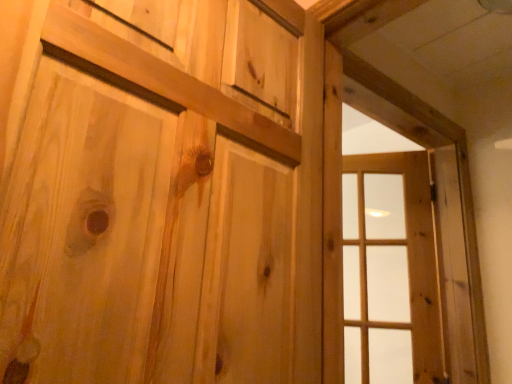
Question: Does natural wood window frame at right have a greater height compared to natural wood door at center?

Choices:
 (A) no
 (B) yes

Answer: (B)

Question: Can you confirm if natural wood window frame at right is shorter than natural wood door at center?

Choices:
 (A) no
 (B) yes

Answer: (A)

Question: Is natural wood window frame at right oriented towards natural wood door at center?

Choices:
 (A) no
 (B) yes

Answer: (A)

Question: Considering the relative positions of natural wood window frame at right and natural wood door at center in the image provided, is natural wood window frame at right to the left of natural wood door at center from the viewer's perspective?

Choices:
 (A) yes
 (B) no

Answer: (B)

Question: Is natural wood window frame at right positioned beyond the bounds of natural wood door at center?

Choices:
 (A) no
 (B) yes

Answer: (B)

Question: Is natural wood window frame at right positioned with its back to natural wood door at center?

Choices:
 (A) yes
 (B) no

Answer: (B)

Question: Can you confirm if clear glass window at right is taller than natural wood window frame at right?

Choices:
 (A) no
 (B) yes

Answer: (A)

Question: Considering the relative sizes of clear glass window at right and natural wood window frame at right in the image provided, is clear glass window at right smaller than natural wood window frame at right?

Choices:
 (A) no
 (B) yes

Answer: (B)

Question: Is clear glass window at right in front of natural wood window frame at right?

Choices:
 (A) no
 (B) yes

Answer: (A)

Question: Is natural wood window frame at right a part of clear glass window at right?

Choices:
 (A) no
 (B) yes

Answer: (A)

Question: Is clear glass window at right oriented towards natural wood window frame at right?

Choices:
 (A) no
 (B) yes

Answer: (B)

Question: From the image's perspective, is clear glass window at right under natural wood window frame at right?

Choices:
 (A) yes
 (B) no

Answer: (A)

Question: From a real-world perspective, is natural wood window frame at right on top of clear glass window at right?

Choices:
 (A) no
 (B) yes

Answer: (B)